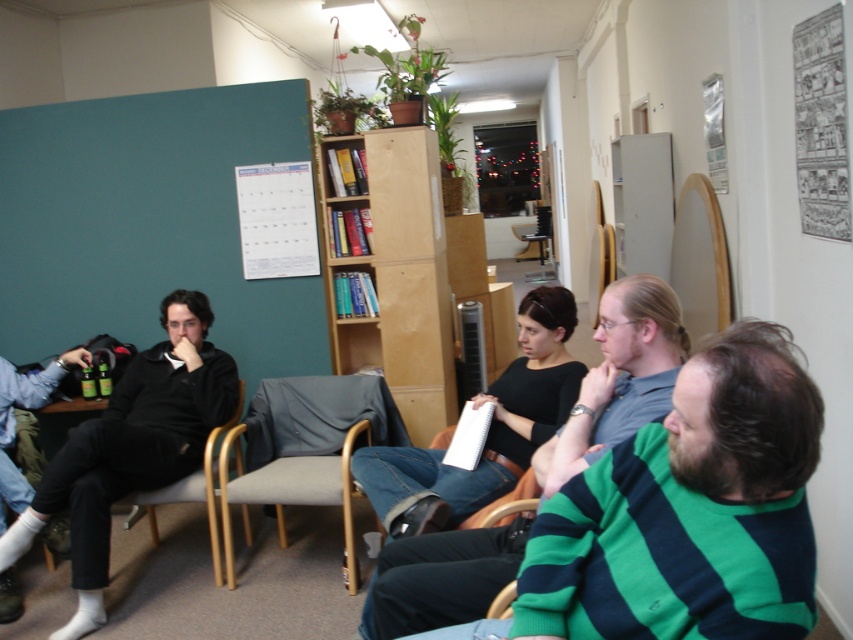
What do you see at coordinates (619, 378) in the screenshot? Image resolution: width=853 pixels, height=640 pixels. I see `green striped sweater at center` at bounding box center [619, 378].

Based on the photo, can you confirm if green striped sweater at center is smaller than black matte clothing at left?

Correct, green striped sweater at center occupies less space than black matte clothing at left.

What do you see at coordinates (619, 378) in the screenshot?
I see `green striped sweater at center` at bounding box center [619, 378].

Where is `green striped sweater at center`? The image size is (853, 640). green striped sweater at center is located at coordinates (619, 378).

Can you confirm if green striped sweater at center is taller than gray fabric armchair at center?

Yes.

The width and height of the screenshot is (853, 640). What do you see at coordinates (619, 378) in the screenshot? I see `green striped sweater at center` at bounding box center [619, 378].

Where is `green striped sweater at center`? The width and height of the screenshot is (853, 640). green striped sweater at center is located at coordinates (619, 378).

Can you confirm if black matte clothing at left is shorter than gray fabric armchair at center?

Incorrect, black matte clothing at left's height does not fall short of gray fabric armchair at center's.

Does point (212, 408) lie behind point (308, 460)?

Yes, it is behind point (308, 460).

Is point (86, 435) more distant than point (223, 538)?

No, (86, 435) is closer to viewer.

The width and height of the screenshot is (853, 640). In order to click on black matte clothing at left in this screenshot , I will do tap(131, 448).